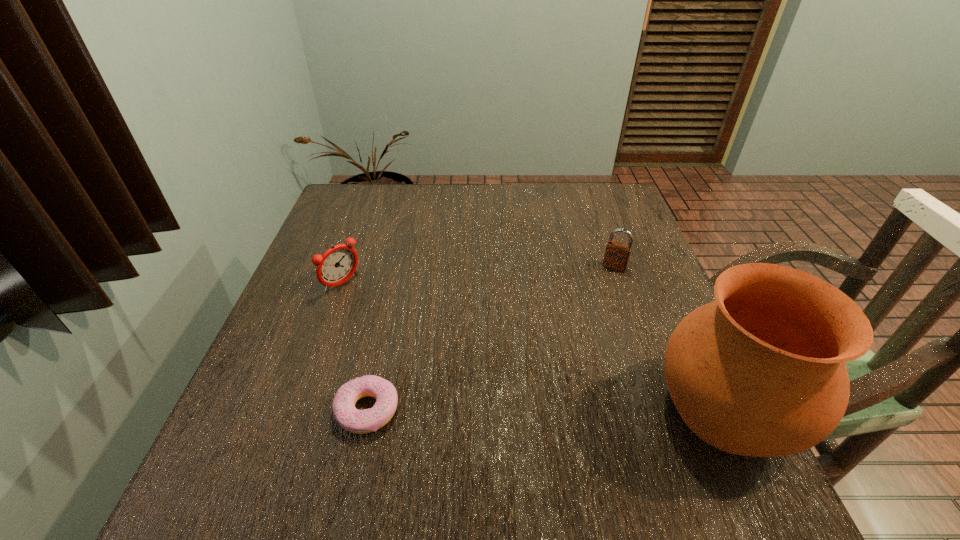
Identify the location of free spot on the desktop that is between the third object from right to left and the tallest object and is positioned on the front-facing side of the padlock. (539, 410).

Image resolution: width=960 pixels, height=540 pixels. Identify the location of free space on the desktop that is between the doughnut and the pottery and is positioned on the front-facing side of the leftmost object. (506, 410).